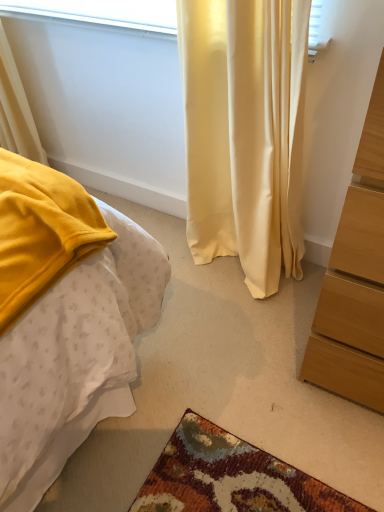
The height and width of the screenshot is (512, 384). Identify the location of vacant space underneath satin yellow curtain at center (from a real-world perspective). (224, 272).